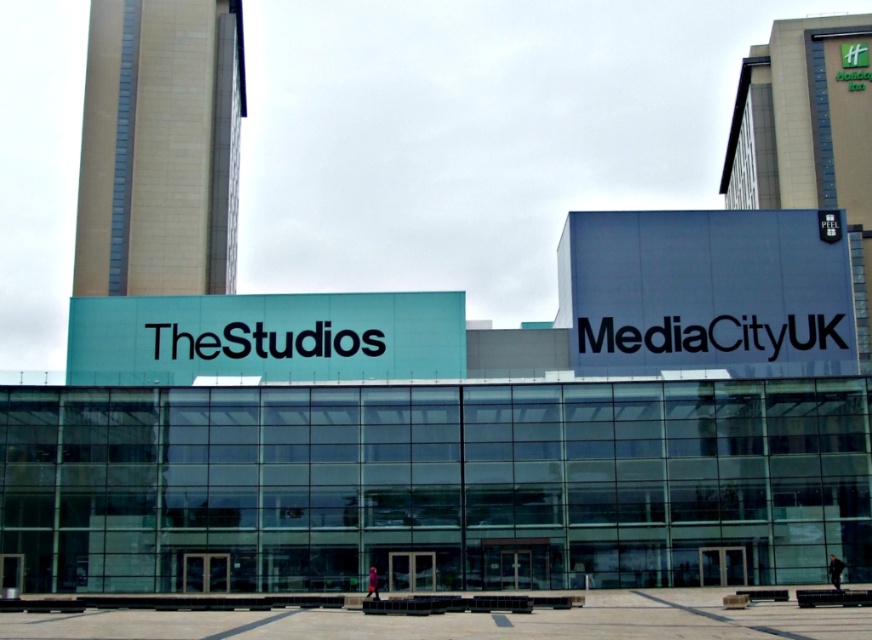
Question: Which of the following is the closest to the observer?

Choices:
 (A) green glass tower at upper right
 (B) beige brick tower at upper left

Answer: (A)

Question: Can you confirm if beige brick tower at upper left is positioned below green glass tower at upper right?

Choices:
 (A) yes
 (B) no

Answer: (A)

Question: Considering the relative positions of beige brick tower at upper left and green glass tower at upper right in the image provided, where is beige brick tower at upper left located with respect to green glass tower at upper right?

Choices:
 (A) above
 (B) below

Answer: (B)

Question: Is beige brick tower at upper left in front of green glass tower at upper right?

Choices:
 (A) no
 (B) yes

Answer: (A)

Question: Which object is farther from the camera taking this photo?

Choices:
 (A) beige brick tower at upper left
 (B) green glass tower at upper right

Answer: (A)